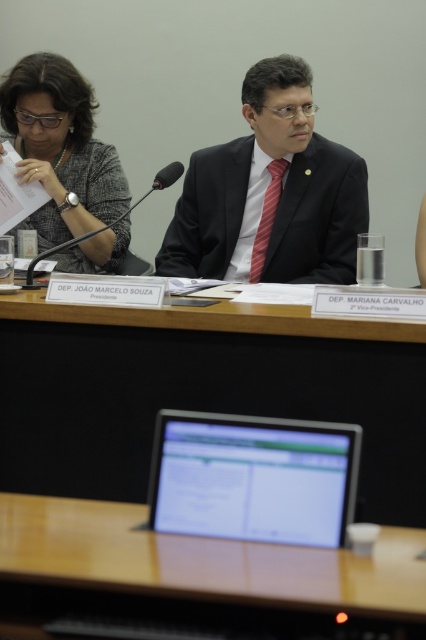
Question: Considering the relative positions of smooth wooden table at center and black matte microphone at upper center in the image provided, where is smooth wooden table at center located with respect to black matte microphone at upper center?

Choices:
 (A) below
 (B) above

Answer: (A)

Question: Which object appears closest to the camera in this image?

Choices:
 (A) silver glossy monitor at center
 (B) wooden table at center

Answer: (B)

Question: Which object is closer to the camera taking this photo?

Choices:
 (A) wooden table at center
 (B) smooth wooden table at center

Answer: (A)

Question: Which point appears closest to the camera in this image?

Choices:
 (A) (195, 275)
 (B) (304, 378)
 (C) (111, 227)
 (D) (83, 209)

Answer: (B)

Question: Is wooden table at center in front of black matte microphone at upper center?

Choices:
 (A) yes
 (B) no

Answer: (A)

Question: Does smooth wooden table at center appear on the right side of matte black suit at center?

Choices:
 (A) yes
 (B) no

Answer: (B)